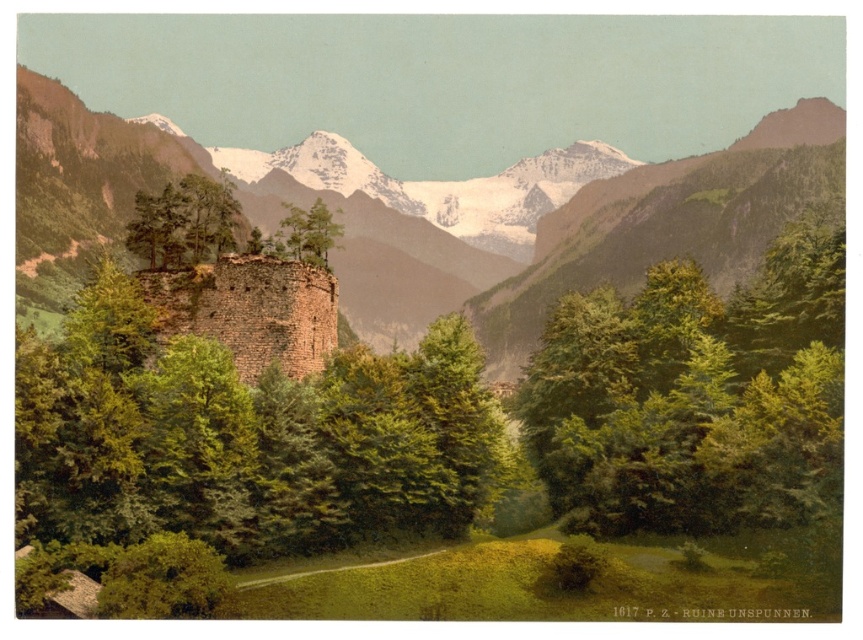
Measure the distance between point (351, 273) and camera.

Point (351, 273) is 317.81 meters from camera.

Does snowy granite mountains at center appear on the right side of brown stone tower at center-left?

Yes, snowy granite mountains at center is to the right of brown stone tower at center-left.

Find the location of a particular element. The height and width of the screenshot is (640, 863). snowy granite mountains at center is located at coordinates (477, 212).

This screenshot has height=640, width=863. I want to click on snowy granite mountains at center, so click(477, 212).

Between snowy granite mountains at center and green textured tree at center, which one is positioned lower?

green textured tree at center

Consider the image. Is snowy granite mountains at center closer to camera compared to green textured tree at center?

Yes, it is.

You are a GUI agent. You are given a task and a screenshot of the screen. Output one action in this format:
    pyautogui.click(x=<x>, y=<y>)
    Task: Click on the snowy granite mountains at center
    Image resolution: width=863 pixels, height=640 pixels.
    Given the screenshot: What is the action you would take?
    pyautogui.click(x=477, y=212)

Between snowy granite mountains at center and green leafy tree at center, which one is positioned lower?

green leafy tree at center is below.

Does point (654, 228) lie behind point (797, 332)?

That is True.

Where is `snowy granite mountains at center`? The width and height of the screenshot is (863, 640). snowy granite mountains at center is located at coordinates pos(477,212).